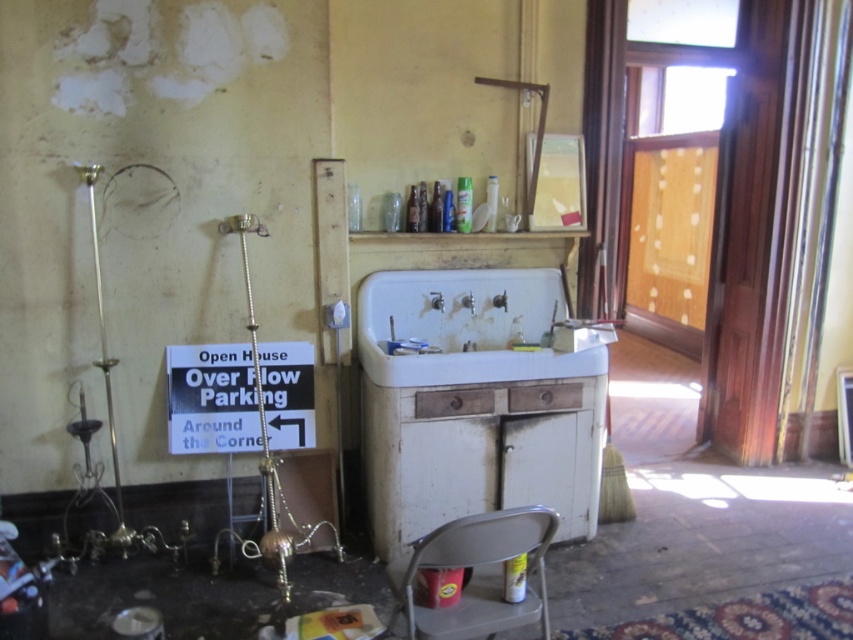
Which is in front, point (488, 300) or point (512, 609)?

Positioned in front is point (512, 609).

Is white porcelain sink at center wider than metallic gray chair at lower center?

Indeed, white porcelain sink at center has a greater width compared to metallic gray chair at lower center.

Locate an element on the screen. The height and width of the screenshot is (640, 853). white porcelain sink at center is located at coordinates (473, 326).

Identify the location of white porcelain sink at center. (473, 326).

Does black paper sign at lower left have a greater height compared to metallic gray chair at lower center?

Incorrect, black paper sign at lower left's height is not larger of metallic gray chair at lower center's.

Between point (251, 388) and point (399, 561), which one is positioned behind?

The point (251, 388) is more distant.

You are a GUI agent. You are given a task and a screenshot of the screen. Output one action in this format:
    pyautogui.click(x=<x>, y=<y>)
    Task: Click on the black paper sign at lower left
    The width and height of the screenshot is (853, 640).
    Given the screenshot: What is the action you would take?
    pyautogui.click(x=212, y=400)

Is white porcelain sink at center below black paper sign at lower left?

No, white porcelain sink at center is not below black paper sign at lower left.

This screenshot has width=853, height=640. What do you see at coordinates (473, 326) in the screenshot? I see `white porcelain sink at center` at bounding box center [473, 326].

This screenshot has height=640, width=853. Identify the location of white porcelain sink at center. (473, 326).